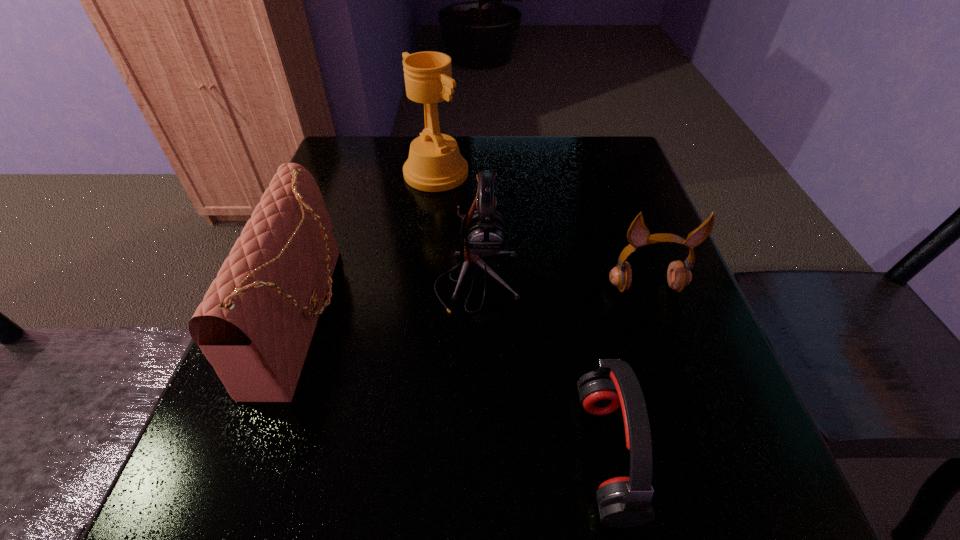
Where is `free spot that satisfies the following two spatial constraints: 1. on the front-facing side of the rightmost earphone; 2. on the ear cups of the second earphone from right to left`? This screenshot has width=960, height=540. free spot that satisfies the following two spatial constraints: 1. on the front-facing side of the rightmost earphone; 2. on the ear cups of the second earphone from right to left is located at coordinates (706, 454).